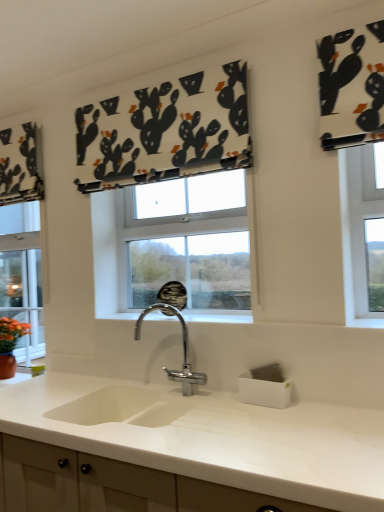
Question: Would you say white matte countertop at center is to the left or to the right of chrome metallic faucet at center in the picture?

Choices:
 (A) right
 (B) left

Answer: (B)

Question: From a real-world perspective, is white matte countertop at center physically located above or below chrome metallic faucet at center?

Choices:
 (A) below
 (B) above

Answer: (A)

Question: Estimate the real-world distances between objects in this image. Which object is farther from the chrome metallic faucet at center?

Choices:
 (A) white matte countertop at center
 (B) black printed fabric at upper center

Answer: (B)

Question: Estimate the real-world distances between objects in this image. Which object is closer to the chrome metallic faucet at center?

Choices:
 (A) white matte countertop at center
 (B) black printed fabric at upper center

Answer: (A)